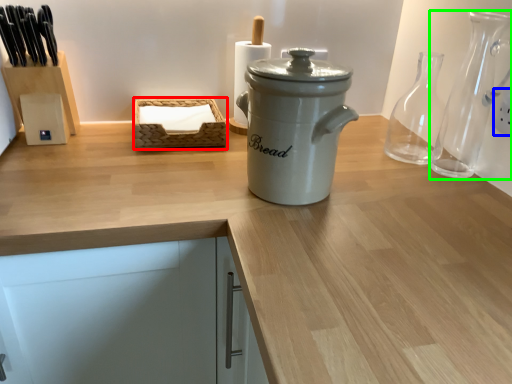
Question: Which object is the farthest from basket (highlighted by a red box)? Choose among these: electric outlet (highlighted by a blue box) or glass vase (highlighted by a green box).

Choices:
 (A) electric outlet
 (B) glass vase

Answer: (A)